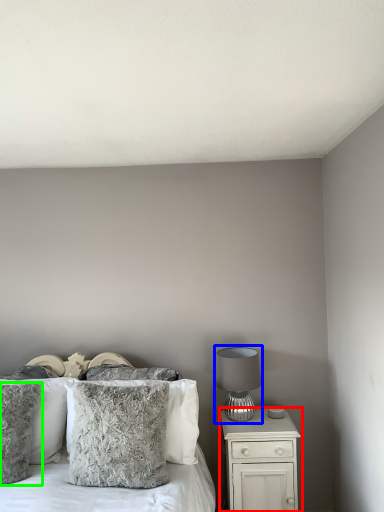
Question: Considering the real-world distances, which object is closest to nightstand (highlighted by a red box)? table lamp (highlighted by a blue box) or pillow (highlighted by a green box).

Choices:
 (A) table lamp
 (B) pillow

Answer: (A)